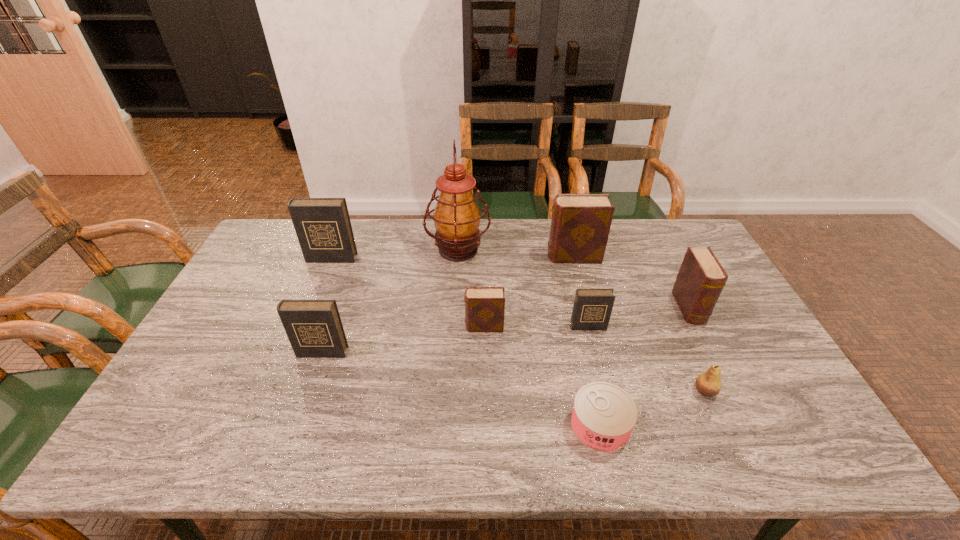
The image size is (960, 540). In order to click on the leftmost brown diary in this screenshot , I will do `click(484, 306)`.

The height and width of the screenshot is (540, 960). What are the coordinates of `the smallest brown diary` in the screenshot? It's located at (484, 306).

You are a GUI agent. You are given a task and a screenshot of the screen. Output one action in this format:
    pyautogui.click(x=<x>, y=<y>)
    Task: Click on the second object from right to left
    Image resolution: width=960 pixels, height=540 pixels.
    Given the screenshot: What is the action you would take?
    pyautogui.click(x=708, y=384)

Locate an element on the screen. The width and height of the screenshot is (960, 540). can is located at coordinates (603, 417).

Where is `free space located on the left of the oil lamp`? This screenshot has height=540, width=960. free space located on the left of the oil lamp is located at coordinates (406, 249).

At what (x,y) coordinates should I click in order to perform the action: click on blank space located 0.330m on the spine side of the second brown diary from right to left. Please return your answer as a coordinate pair (x, y). The width and height of the screenshot is (960, 540). Looking at the image, I should click on (450, 256).

Locate an element on the screen. The image size is (960, 540). vacant space located on the spine side of the second brown diary from right to left is located at coordinates (436, 256).

Where is `free space located 0.270m on the spine side of the second brown diary from right to left`? The image size is (960, 540). free space located 0.270m on the spine side of the second brown diary from right to left is located at coordinates click(468, 256).

Where is `free region located 0.390m on the front cover of the farthest dark diary`? This screenshot has height=540, width=960. free region located 0.390m on the front cover of the farthest dark diary is located at coordinates (292, 354).

Where is `blank space located 0.210m on the spine side of the rightmost diary`? blank space located 0.210m on the spine side of the rightmost diary is located at coordinates (730, 388).